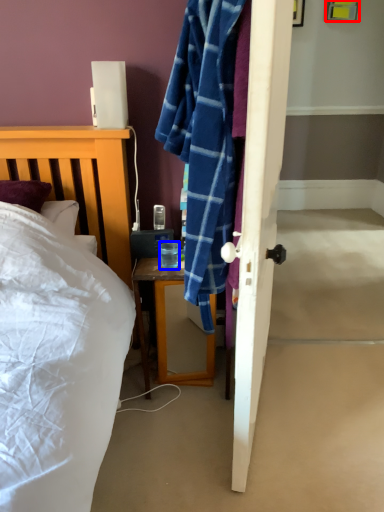
Question: Which object appears farthest to the camera in this image, picture frame (highlighted by a red box) or coffee cup (highlighted by a blue box)?

Choices:
 (A) picture frame
 (B) coffee cup

Answer: (A)